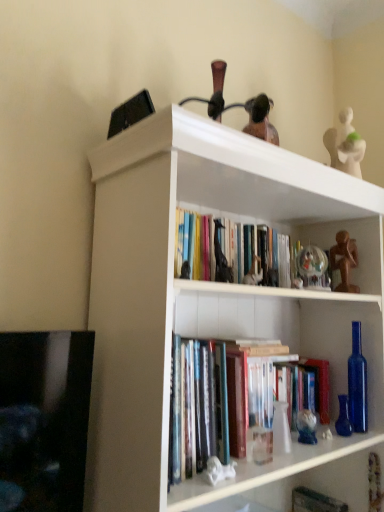
Question: Which direction should I rotate to face white glossy statue at lower center, acting as the 5th toy starting from the back, — up or down?

Choices:
 (A) down
 (B) up

Answer: (A)

Question: Considering the relative sizes of matte black giraffe at center, the 4th toy when ordered from right to left, and white glossy statue at lower center, the 1th toy positioned from the left, in the image provided, is matte black giraffe at center, the 4th toy when ordered from right to left, thinner than white glossy statue at lower center, the 1th toy positioned from the left,?

Choices:
 (A) yes
 (B) no

Answer: (B)

Question: From a real-world perspective, is matte black giraffe at center, the 4th toy when ordered from right to left, on white glossy statue at lower center, placed as the first toy when sorted from front to back?

Choices:
 (A) no
 (B) yes

Answer: (B)

Question: Is matte black giraffe at center, the 4th toy when ordered from right to left, closer to the viewer compared to white glossy statue at lower center, the 1th toy positioned from the left?

Choices:
 (A) yes
 (B) no

Answer: (B)

Question: From the image's perspective, does matte black giraffe at center, which is the first toy in top-to-bottom order, appear higher than white glossy statue at lower center, arranged as the 5th toy when viewed from the right?

Choices:
 (A) yes
 (B) no

Answer: (A)

Question: Can you confirm if matte black giraffe at center, which is counted as the 4th toy, starting from the back, is wider than white glossy statue at lower center, the 1th toy positioned from the left?

Choices:
 (A) no
 (B) yes

Answer: (B)

Question: Considering the relative sizes of matte black giraffe at center, which is counted as the 4th toy, starting from the back, and white glossy statue at lower center, the second toy in the bottom-to-top sequence, in the image provided, is matte black giraffe at center, which is counted as the 4th toy, starting from the back, taller than white glossy statue at lower center, the second toy in the bottom-to-top sequence,?

Choices:
 (A) no
 (B) yes

Answer: (B)

Question: From a real-world perspective, is translucent glass figurine at center, the 5th toy positioned from the top, located beneath white glossy statue at lower center, the second toy in the bottom-to-top sequence?

Choices:
 (A) no
 (B) yes

Answer: (A)

Question: From a real-world perspective, is translucent glass figurine at center, the first toy from the bottom, on white glossy statue at lower center, acting as the 4th toy starting from the top?

Choices:
 (A) no
 (B) yes

Answer: (B)

Question: Is translucent glass figurine at center, the first toy from the bottom, to the right of white glossy statue at lower center, acting as the 5th toy starting from the back, from the viewer's perspective?

Choices:
 (A) no
 (B) yes

Answer: (B)

Question: From the image's perspective, is translucent glass figurine at center, the 3th toy from the left, located above white glossy statue at lower center, the 1th toy positioned from the left?

Choices:
 (A) no
 (B) yes

Answer: (A)

Question: Is the position of translucent glass figurine at center, the 3th toy from the left, more distant than that of white glossy statue at lower center, arranged as the 5th toy when viewed from the right?

Choices:
 (A) no
 (B) yes

Answer: (B)

Question: Does translucent glass figurine at center, the 5th toy positioned from the top, contain white glossy statue at lower center, the 1th toy positioned from the left?

Choices:
 (A) yes
 (B) no

Answer: (B)

Question: Is transparent glass globe at upper center, which is the 3th toy from bottom to top, smaller than white glossy statue at lower center, acting as the 4th toy starting from the top?

Choices:
 (A) no
 (B) yes

Answer: (A)